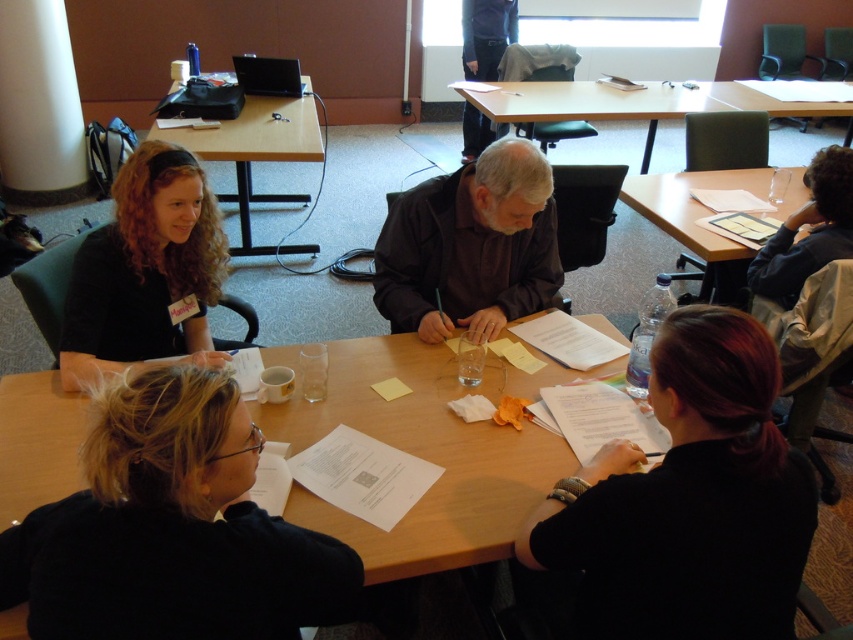
Can you confirm if blonde hair at center is positioned above dark gray shirt at upper center?

Incorrect, blonde hair at center is not positioned above dark gray shirt at upper center.

Is blonde hair at center in front of dark gray shirt at upper center?

That is True.

Is point (276, 556) behind point (497, 26)?

No, (276, 556) is closer to viewer.

You are a GUI agent. You are given a task and a screenshot of the screen. Output one action in this format:
    pyautogui.click(x=<x>, y=<y>)
    Task: Click on the blonde hair at center
    The image size is (853, 640).
    Given the screenshot: What is the action you would take?
    pyautogui.click(x=171, y=529)

Which is below, black fabric shirt at lower right or curly hair at center?

black fabric shirt at lower right is lower down.

Locate an element on the screen. black fabric shirt at lower right is located at coordinates (688, 500).

The width and height of the screenshot is (853, 640). What do you see at coordinates (688, 500) in the screenshot? I see `black fabric shirt at lower right` at bounding box center [688, 500].

This screenshot has height=640, width=853. What are the coordinates of `black fabric shirt at lower right` in the screenshot? It's located at (688, 500).

Is dark brown shirt at center positioned in front of clear plastic water bottle at right?

That is True.

Is point (488, 237) in front of point (683, 193)?

That is True.

Image resolution: width=853 pixels, height=640 pixels. Find the location of `dark brown shirt at center`. dark brown shirt at center is located at coordinates (469, 246).

You are a GUI agent. You are given a task and a screenshot of the screen. Output one action in this format:
    pyautogui.click(x=<x>, y=<y>)
    Task: Click on the dark brown shirt at center
    The height and width of the screenshot is (640, 853).
    Given the screenshot: What is the action you would take?
    pyautogui.click(x=469, y=246)